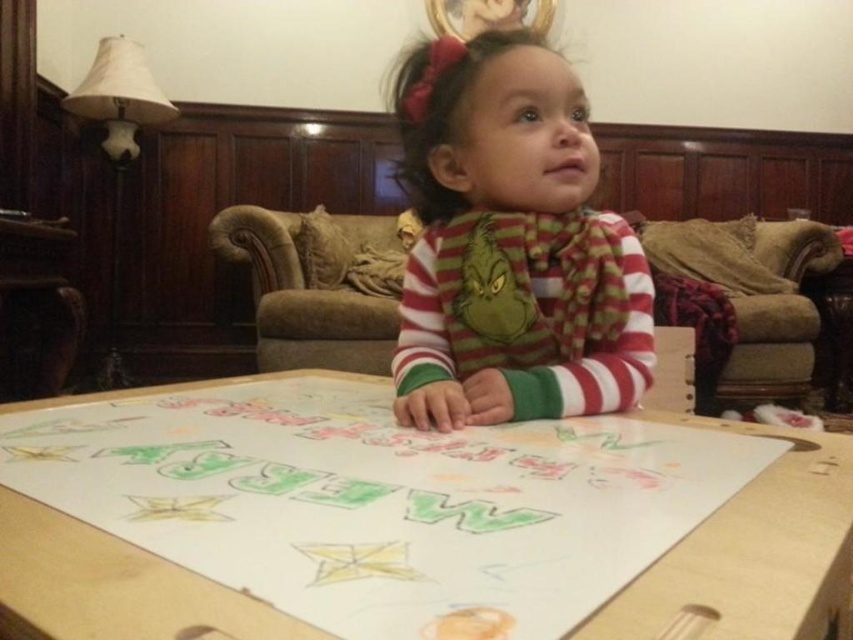
Is wooden table at center closer to the viewer compared to striped cotton shirt at center?

Yes, it is.

Who is shorter, wooden table at center or striped cotton shirt at center?

Standing shorter between the two is wooden table at center.

I want to click on wooden table at center, so click(x=404, y=520).